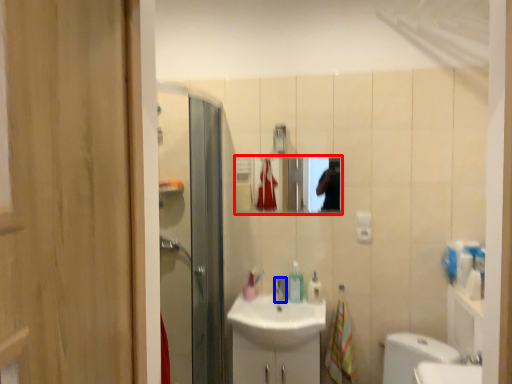
Question: Which of the following is the farthest to the observer, mirror (highlighted by a red box) or tap (highlighted by a blue box)?

Choices:
 (A) mirror
 (B) tap

Answer: (A)